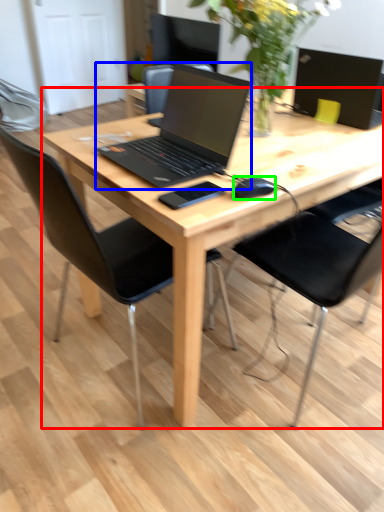
Question: Which object is the farthest from desk (highlighted by a red box)? Choose among these: laptop (highlighted by a blue box) or mouse (highlighted by a green box).

Choices:
 (A) laptop
 (B) mouse

Answer: (B)